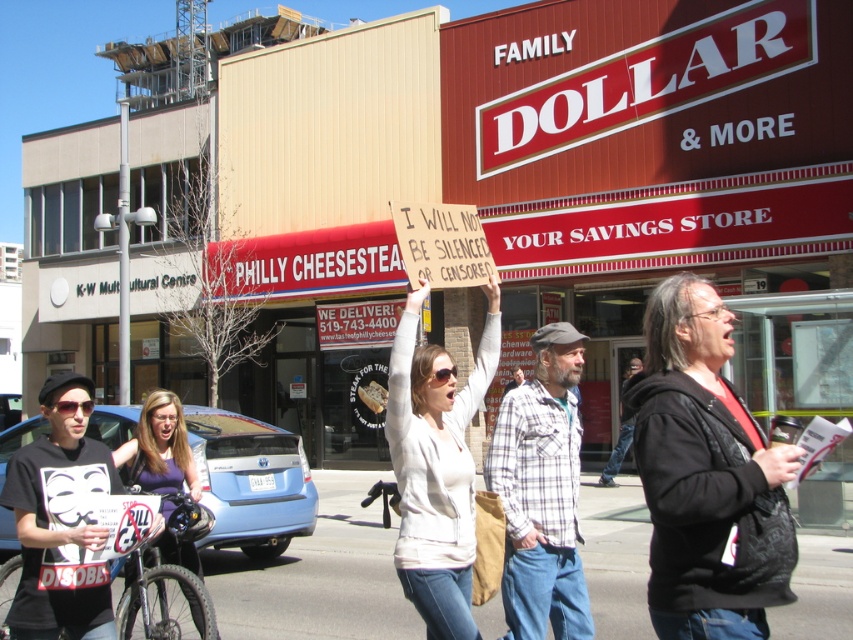
You are a photographer standing in front of the Family Dollar store and see two people wearing a black leather jacket at center and a plaid flannel shirt at center. Which clothing item is located to the right of the other?

The black leather jacket at center is positioned on the right side of plaid flannel shirt at center, so it is to the right of the plaid flannel shirt at center.

You are a delivery person with a 2.5 meter long ladder. You need to place the ladder between the white cotton shirt at center and the purple fabric shirt at lower left to reach a high shelf. Is the space between them sufficient for the ladder?

The distance between the white cotton shirt at center and the purple fabric shirt at lower left is 2.66 meters, which is longer than the 2.5 meter ladder. Therefore, the space is sufficient for placing the ladder between them.

You are a photographer taking a picture of the protest in front of the Family Dollar store. You notice the white cotton shirt at center and the purple fabric shirt at lower left. Which shirt is closer to the camera?

The white cotton shirt at center is closer to the camera because it is in front of the purple fabric shirt at lower left.